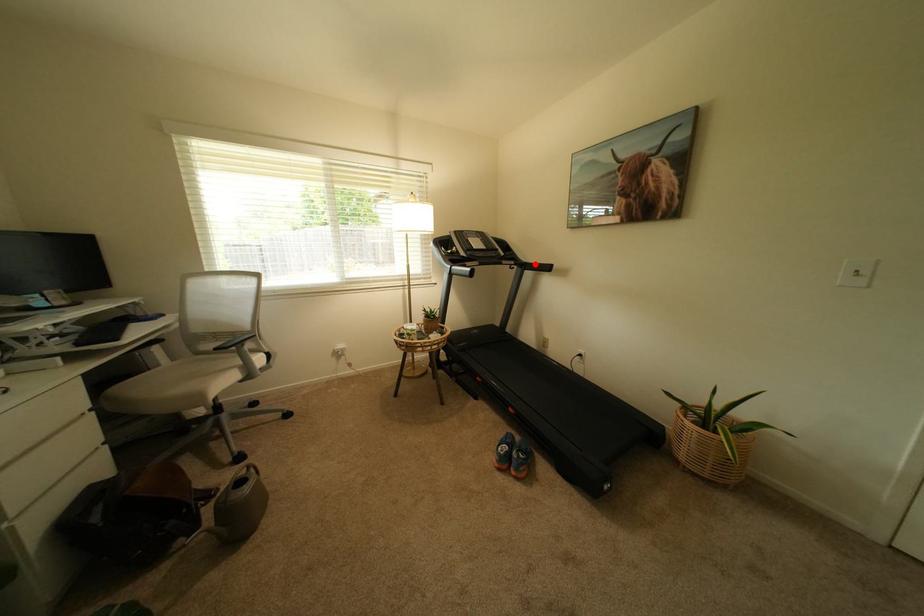
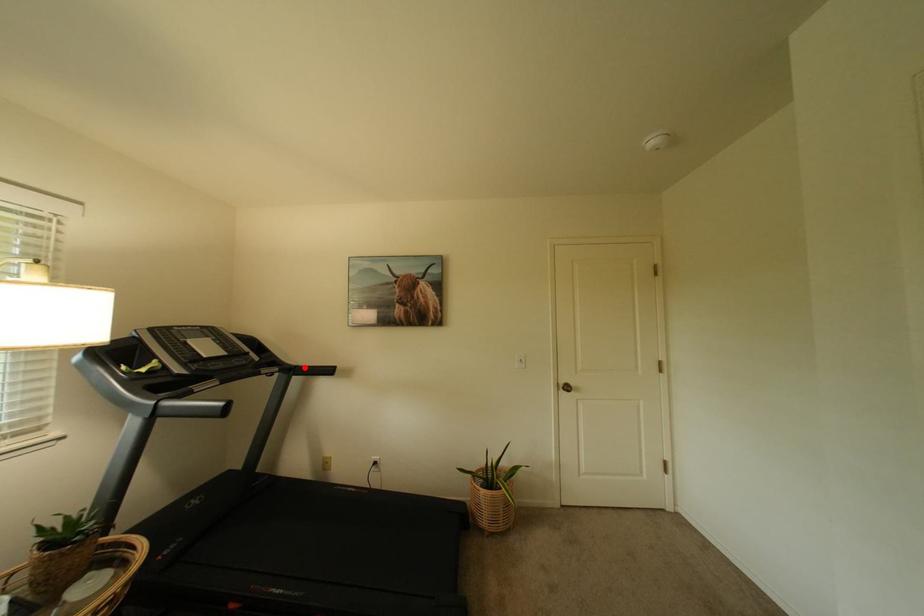
I am providing you with two images of the same scene from different viewpoints. A red point is marked on the first image and another point is marked on the second image. Are the points marked in image1 and image2 representing the same 3D position?

Yes